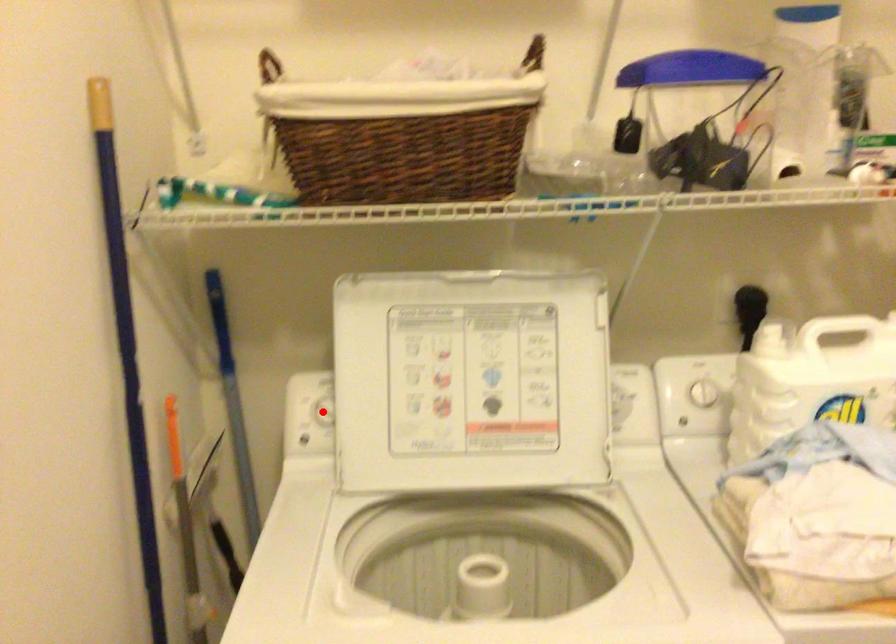
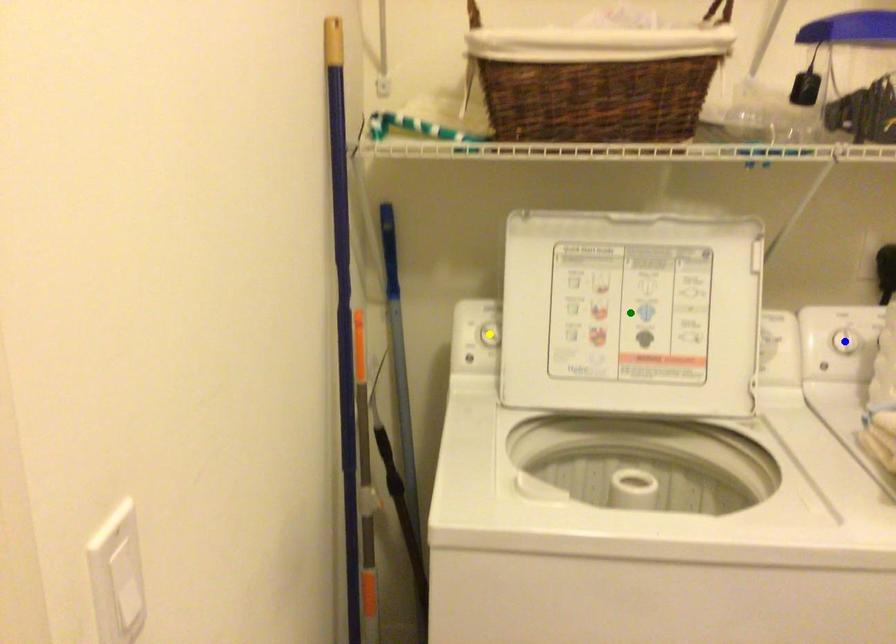
Question: I am providing you with two images of the same scene from different viewpoints. A red point is marked on the first image. You are given multiple points on the second image. Which spot in image 2 lines up with the point in image 1?

Choices:
 (A) blue point
 (B) green point
 (C) yellow point

Answer: (C)